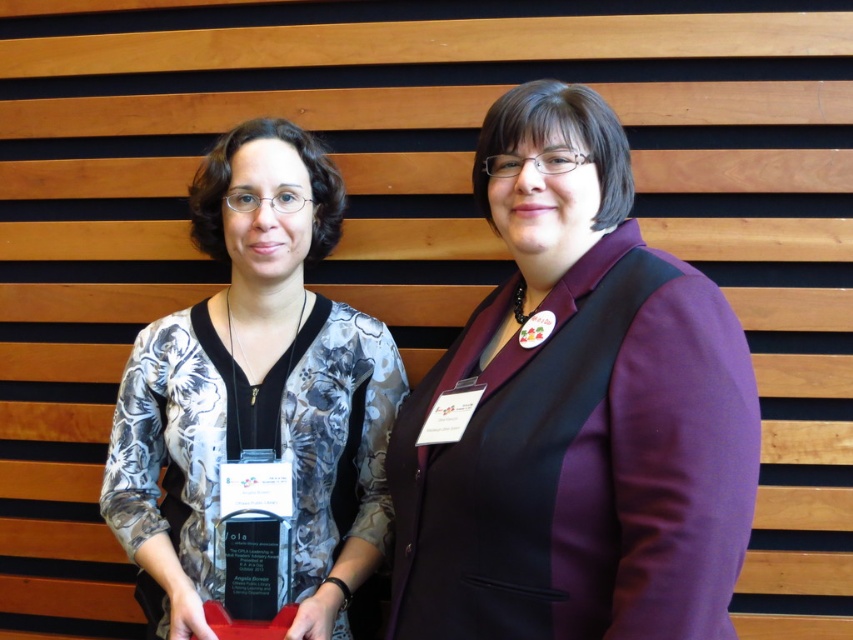
You are organizing a photo shoot and need to arrange the two people so that the purple matte blazer at center is on the left side of the printed fabric blouse at center. Based on the current image, do you need to move either of them?

The purple matte blazer at center is currently on the right side of the printed fabric blouse at center. To have the purple matte blazer at center on the left side, you would need to swap their positions so that the printed fabric blouse at center moves to the right and the purple matte blazer at center moves to the left.